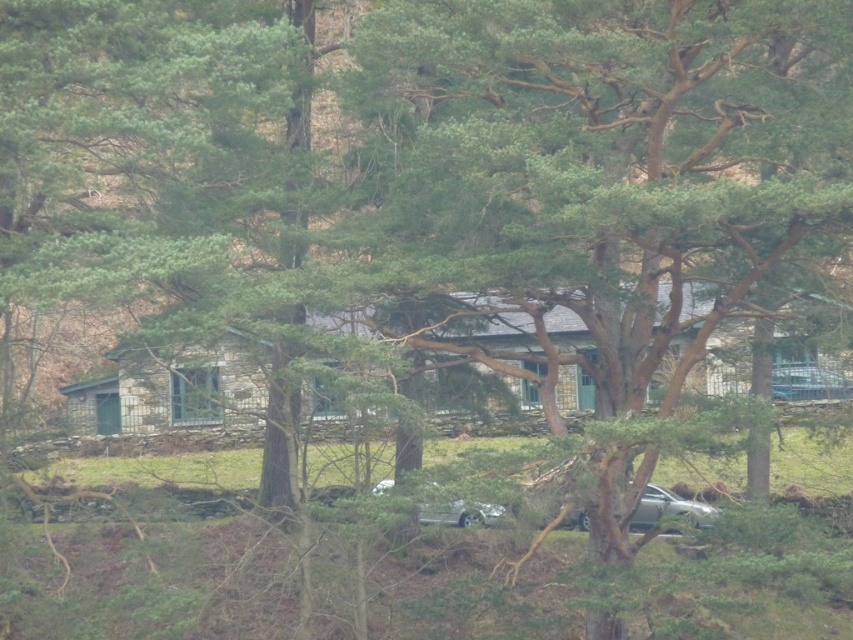
You are a visitor arriving at the stone house and see the silver metallic car at lower center and the metallic silver car at center. Which car is closer to the house?

The metallic silver car at center is closer to the house because the silver metallic car at lower center is positioned on its right side, meaning it is further away from the house.